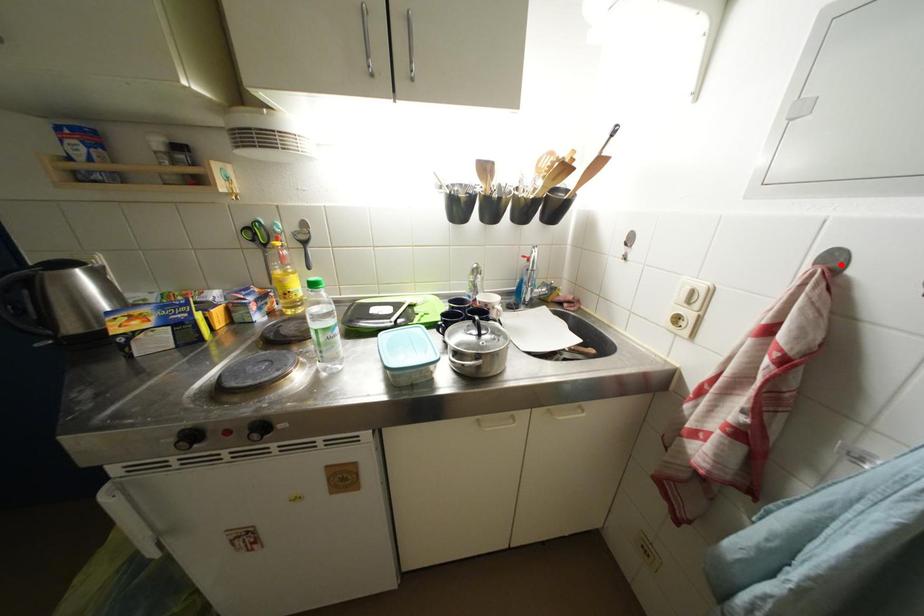
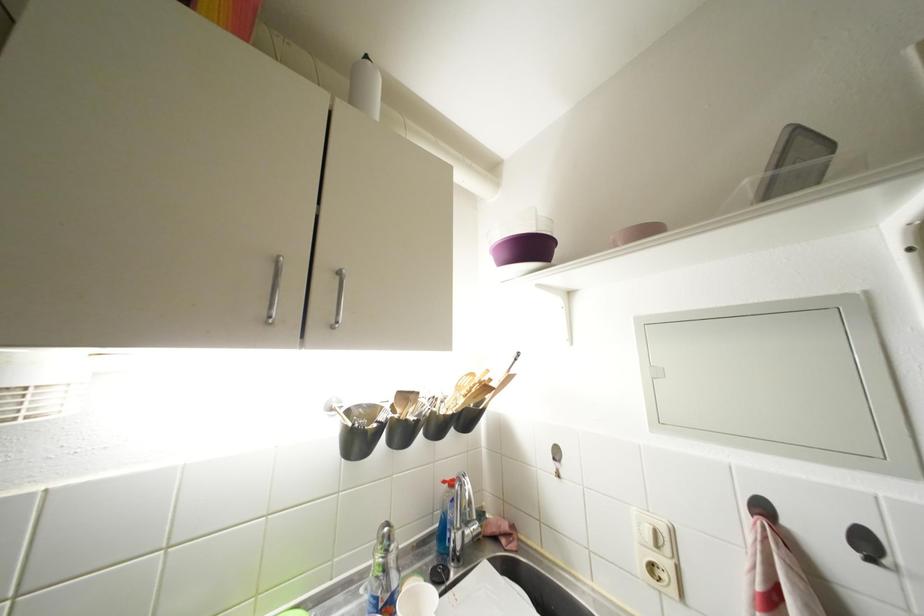
Question: I am providing you with two images of the same scene from different viewpoints. A red point is marked on the first image. Is the red point's position out of view in image 2?

Choices:
 (A) Yes
 (B) No

Answer: (B)